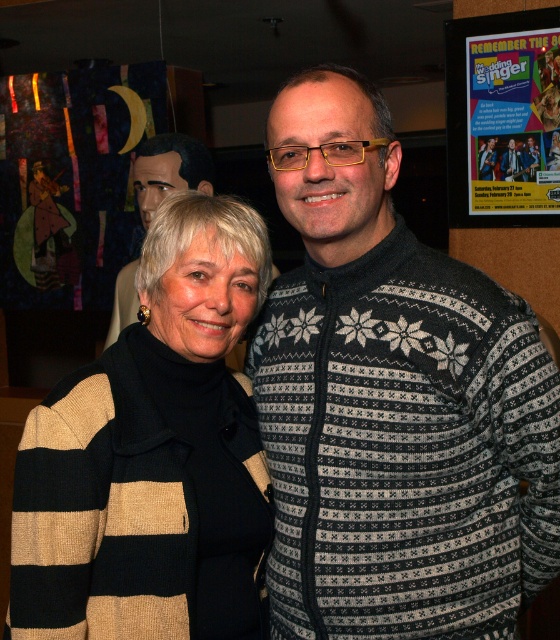
Who is taller, knit sweater at center or matte paper poster at upper right?

Standing taller between the two is knit sweater at center.

Is knit sweater at center shorter than matte paper poster at upper right?

No.

Find the location of a particular element. The image size is (560, 640). knit sweater at center is located at coordinates (393, 401).

Find the location of a particular element. knit sweater at center is located at coordinates (393, 401).

Can you confirm if knit sweater at center is bigger than striped wool sweater at center?

Yes.

Can you confirm if knit sweater at center is positioned to the right of striped wool sweater at center?

Correct, you'll find knit sweater at center to the right of striped wool sweater at center.

Who is more distant from viewer, (x=274, y=593) or (x=151, y=588)?

The point (x=274, y=593) is more distant.

Locate an element on the screen. The height and width of the screenshot is (640, 560). knit sweater at center is located at coordinates (393, 401).

Can you confirm if striped wool sweater at center is positioned above knitted sweater at center?

Actually, striped wool sweater at center is below knitted sweater at center.

The width and height of the screenshot is (560, 640). Identify the location of striped wool sweater at center. (154, 456).